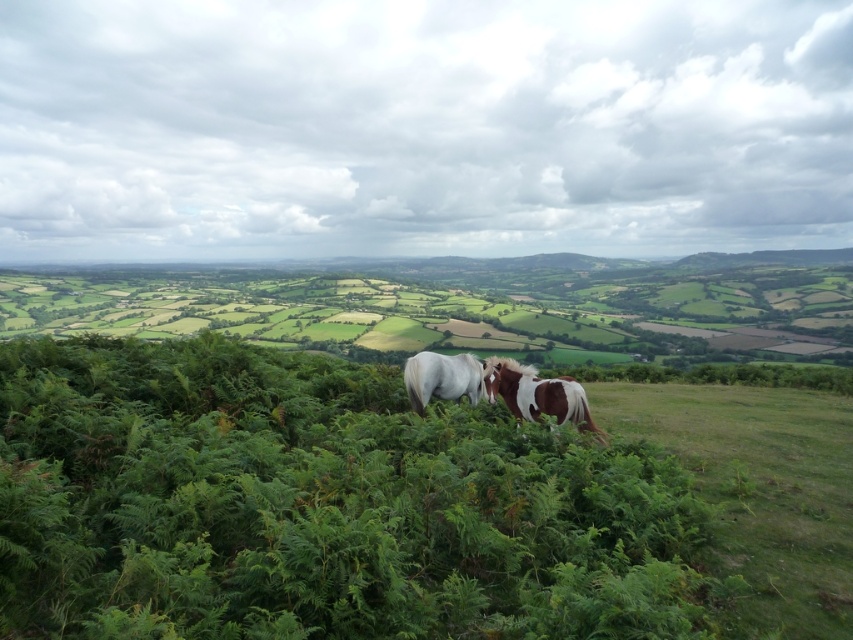
Question: Is green leafy shrubs at center thinner than pinto-patterned horse at center?

Choices:
 (A) yes
 (B) no

Answer: (B)

Question: Is the position of pinto-patterned horse at center less distant than that of white glossy horse at center?

Choices:
 (A) yes
 (B) no

Answer: (A)

Question: Which point is closer to the camera taking this photo?

Choices:
 (A) (503, 365)
 (B) (352, 403)
 (C) (439, 390)

Answer: (A)

Question: Is green leafy shrubs at center in front of pinto-patterned horse at center?

Choices:
 (A) no
 (B) yes

Answer: (B)

Question: Which point appears farthest from the camera in this image?

Choices:
 (A) (x=463, y=365)
 (B) (x=495, y=582)

Answer: (A)

Question: Among these objects, which one is nearest to the camera?

Choices:
 (A) green leafy shrubs at center
 (B) white glossy horse at center
 (C) pinto-patterned horse at center

Answer: (A)